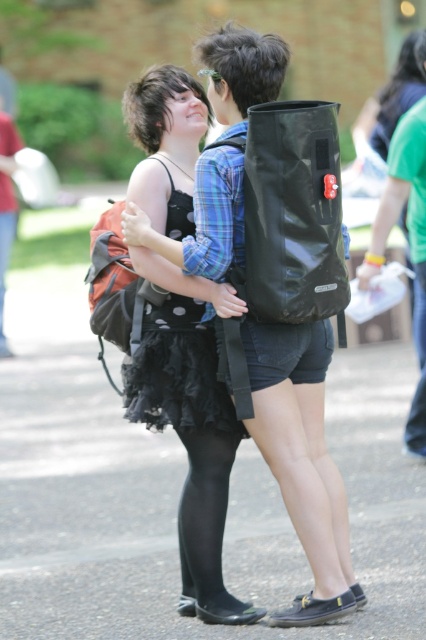
Looking at the scene described, which object is positioned to the left of the other between the black tulle skirt at center and the green fabric shirt at upper right?

The black tulle skirt at center is positioned to the left of the green fabric shirt at upper right.

You are trying to decide whether to place a new rectangular box that is 1 meter wide between the black matte backpack at center and the green fabric shirt at upper right. Based on their widths, will the box fit between them?

The black matte backpack at center is wider than the green fabric shirt at upper right. Since the backpack is wider, the total space between them might be sufficient to fit the 1 meter wide box, but this depends on their exact positions. However, the description only provides information about their widths, not the distance between them. Therefore, we cannot definitively determine if the box will fit solely based on the width comparison.